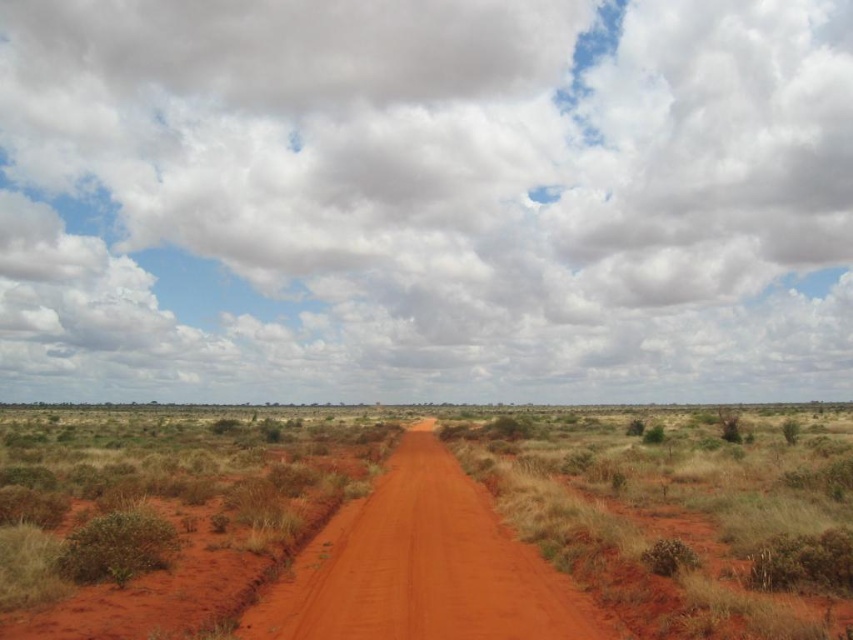
Can you confirm if dusty red dirt road at center is wider than dusty red dirt track at center?

Yes.

Between dusty red dirt road at center and dusty red dirt track at center, which one is positioned lower?

dusty red dirt road at center is below.

Locate an element on the screen. The width and height of the screenshot is (853, 640). dusty red dirt road at center is located at coordinates (428, 524).

Who is lower down, cloudy sky at upper center or dusty red dirt track at center?

dusty red dirt track at center is lower down.

Consider the image. Does cloudy sky at upper center have a greater height compared to dusty red dirt track at center?

Indeed, cloudy sky at upper center has a greater height compared to dusty red dirt track at center.

Where is `cloudy sky at upper center`? The width and height of the screenshot is (853, 640). cloudy sky at upper center is located at coordinates (425, 200).

Based on the photo, between cloudy sky at upper center and dusty red dirt road at center, which one appears on the right side from the viewer's perspective?

cloudy sky at upper center

The image size is (853, 640). Find the location of `cloudy sky at upper center`. cloudy sky at upper center is located at coordinates (425, 200).